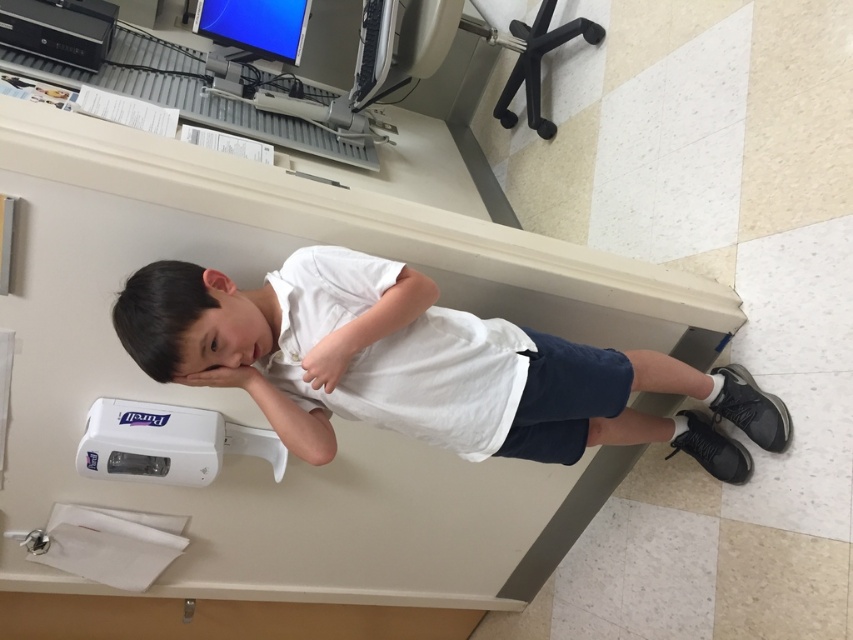
Based on the photo, is white cotton shirt at center to the left of black matte hair at upper center from the viewer's perspective?

No, white cotton shirt at center is not to the left of black matte hair at upper center.

Between point (532, 397) and point (126, 314), which one is positioned in front?

Positioned in front is point (126, 314).

The width and height of the screenshot is (853, 640). I want to click on white cotton shirt at center, so click(x=421, y=365).

I want to click on white cotton shirt at center, so click(x=421, y=365).